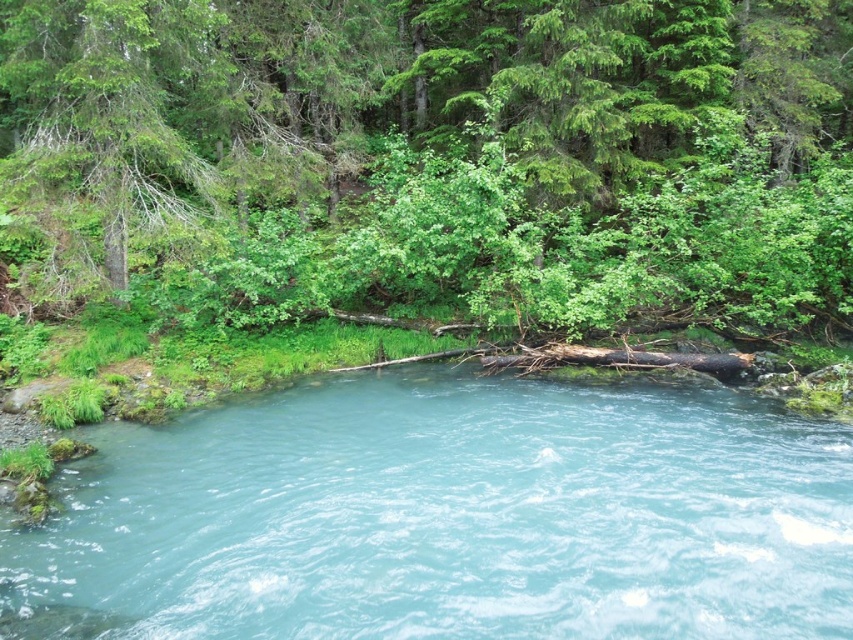
Question: Among these points, which one is farthest from the camera?

Choices:
 (A) (132, 202)
 (B) (222, 634)
 (C) (596, 291)

Answer: (A)

Question: Is green leafy tree at upper center thinner than clear blue water at center?

Choices:
 (A) yes
 (B) no

Answer: (B)

Question: Which of the following is the farthest from the observer?

Choices:
 (A) green leafy tree at upper center
 (B) green leafy tree at upper left
 (C) clear blue water at center

Answer: (B)

Question: Does green leafy tree at upper center have a smaller size compared to clear blue water at center?

Choices:
 (A) no
 (B) yes

Answer: (A)

Question: Estimate the real-world distances between objects in this image. Which object is farther from the green leafy tree at upper center?

Choices:
 (A) green leafy tree at upper left
 (B) clear blue water at center

Answer: (A)

Question: Is green leafy tree at upper center in front of green leafy tree at upper left?

Choices:
 (A) no
 (B) yes

Answer: (B)